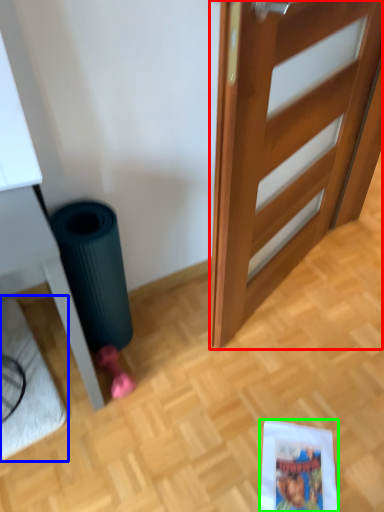
Question: Which is nearer to the door (highlighted by a red box)? doormat (highlighted by a blue box) or comic book (highlighted by a green box).

Choices:
 (A) doormat
 (B) comic book

Answer: (B)